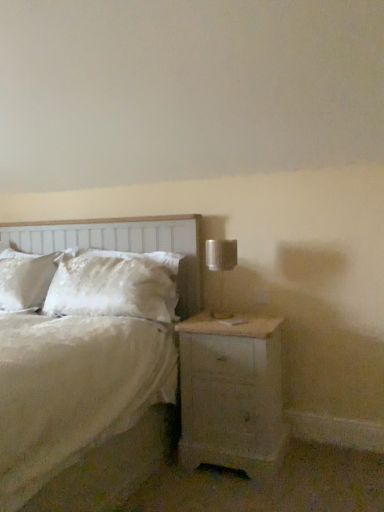
The image size is (384, 512). I want to click on free space above white painted wood nightstand at lower right (from a real-world perspective), so click(x=238, y=320).